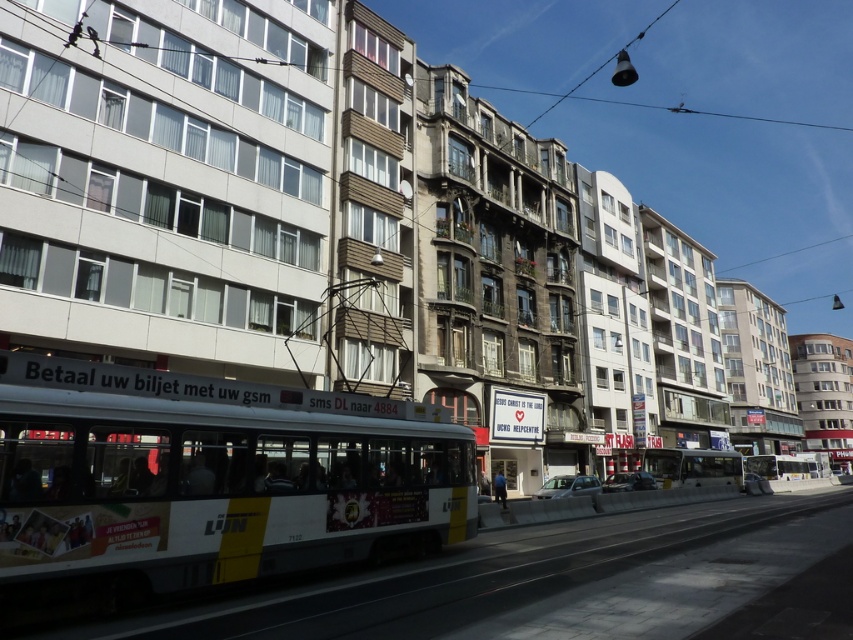
Does white glossy bus at center appear on the left side of yellow metallic bus at center?

Correct, you'll find white glossy bus at center to the left of yellow metallic bus at center.

Which is behind, point (62, 394) or point (759, 476)?

The point (759, 476) is more distant.

Where is `white glossy bus at center`? The height and width of the screenshot is (640, 853). white glossy bus at center is located at coordinates (209, 480).

Does point (207, 579) lie behind point (669, 472)?

No, (207, 579) is closer to viewer.

Is white glossy bus at center shorter than white metallic bus at center?

No.

Between point (292, 520) and point (738, 481), which one is positioned in front?

Point (292, 520) is more forward.

Where is `white glossy bus at center`? white glossy bus at center is located at coordinates (209, 480).

Who is taller, white metallic bus at center or yellow metallic bus at center?

yellow metallic bus at center

Which is in front, point (685, 460) or point (770, 472)?

Point (685, 460) is in front.

Locate an element on the screen. The height and width of the screenshot is (640, 853). white metallic bus at center is located at coordinates (693, 467).